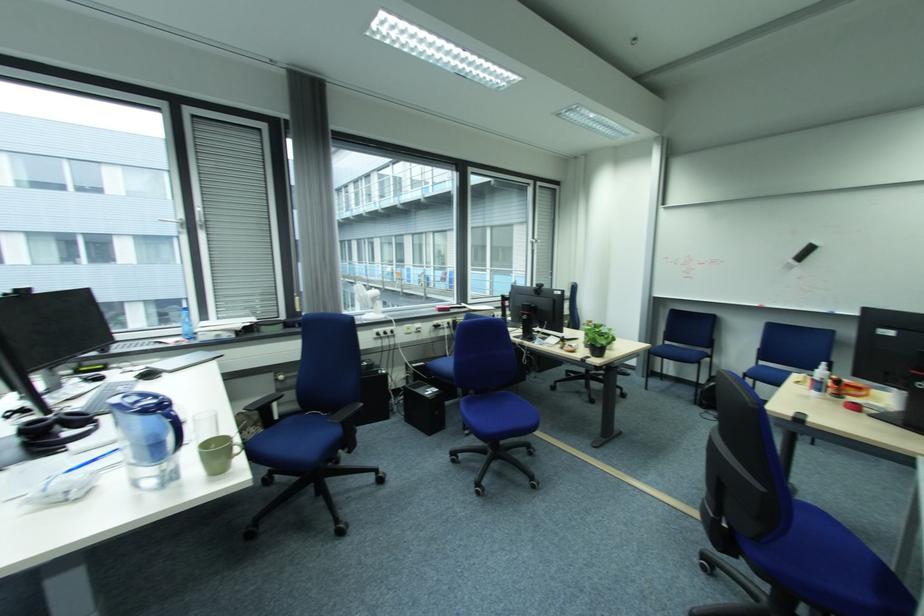
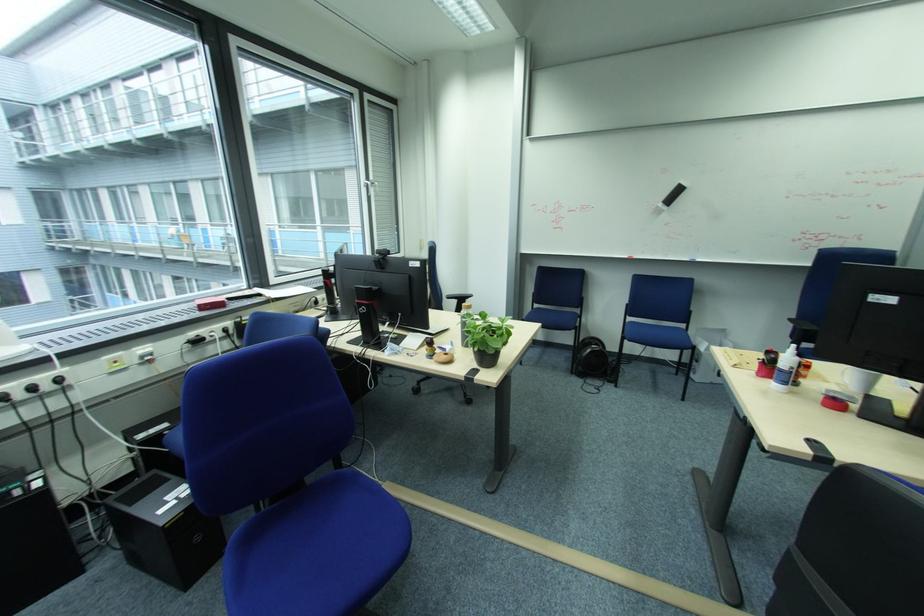
The point at (615, 337) is marked in the first image. Where is the corresponding point in the second image?

(508, 333)